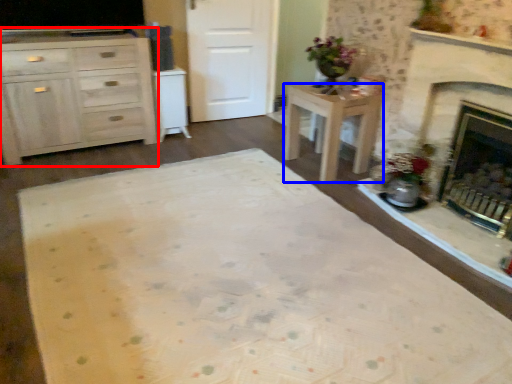
Question: Which object is closer to the camera taking this photo, cabinetry (highlighted by a red box) or desk (highlighted by a blue box)?

Choices:
 (A) cabinetry
 (B) desk

Answer: (A)